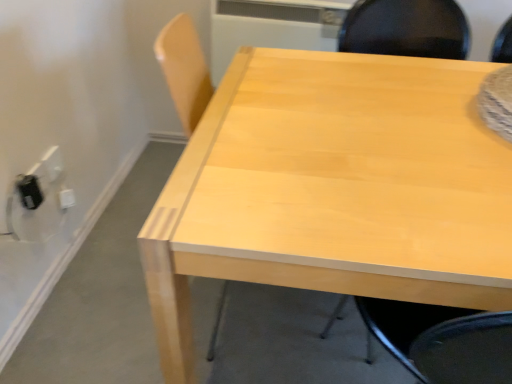
Question: Does light wood table at center have a lesser width compared to black plastic outlet at lower left, the 2th electric outlet positioned from the back?

Choices:
 (A) yes
 (B) no

Answer: (B)

Question: Can you confirm if light wood table at center is bigger than black plastic outlet at lower left, the 2th electric outlet positioned from the back?

Choices:
 (A) yes
 (B) no

Answer: (A)

Question: Considering the relative sizes of light wood table at center and black plastic outlet at lower left, which is the 1th electric outlet from front to back, in the image provided, is light wood table at center smaller than black plastic outlet at lower left, which is the 1th electric outlet from front to back,?

Choices:
 (A) yes
 (B) no

Answer: (B)

Question: From a real-world perspective, is light wood table at center over black plastic outlet at lower left, which is the 1th electric outlet from front to back?

Choices:
 (A) yes
 (B) no

Answer: (B)

Question: From the image's perspective, is light wood table at center on black plastic outlet at lower left, the 2th electric outlet positioned from the back?

Choices:
 (A) no
 (B) yes

Answer: (A)

Question: Is light wood table at center positioned with its back to black plastic outlet at lower left, the 2th electric outlet positioned from the back?

Choices:
 (A) yes
 (B) no

Answer: (B)

Question: From a real-world perspective, is white plastic electric outlet at lower left, the second electric outlet in the front-to-back sequence, below light wood table at center?

Choices:
 (A) yes
 (B) no

Answer: (A)

Question: Is white plastic electric outlet at lower left, marked as the first electric outlet in a back-to-front arrangement, at the right side of light wood table at center?

Choices:
 (A) no
 (B) yes

Answer: (A)

Question: Considering the relative sizes of white plastic electric outlet at lower left, the second electric outlet in the front-to-back sequence, and light wood table at center in the image provided, is white plastic electric outlet at lower left, the second electric outlet in the front-to-back sequence, bigger than light wood table at center?

Choices:
 (A) yes
 (B) no

Answer: (B)

Question: From the image's perspective, is white plastic electric outlet at lower left, marked as the first electric outlet in a back-to-front arrangement, over light wood table at center?

Choices:
 (A) yes
 (B) no

Answer: (A)

Question: Is white plastic electric outlet at lower left, marked as the first electric outlet in a back-to-front arrangement, at the left side of light wood table at center?

Choices:
 (A) no
 (B) yes

Answer: (B)

Question: Does white plastic electric outlet at lower left, marked as the first electric outlet in a back-to-front arrangement, lie in front of light wood table at center?

Choices:
 (A) no
 (B) yes

Answer: (A)

Question: From a real-world perspective, does white plastic electric outlet at lower left, the second electric outlet in the front-to-back sequence, stand above light wood chair at upper right?

Choices:
 (A) yes
 (B) no

Answer: (B)